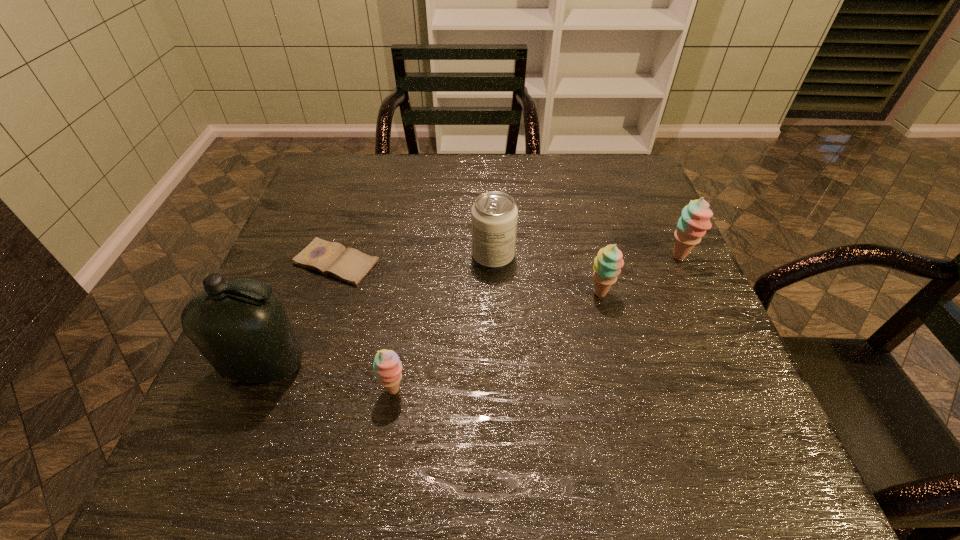
Find the location of a particular element. The image size is (960, 540). unoccupied area between the soda can and the second sherbert from right to left is located at coordinates (547, 275).

I want to click on free space between the bottle and the second nearest sherbert, so click(433, 330).

Locate an element on the screen. The height and width of the screenshot is (540, 960). free spot between the third object from right to left and the second sherbert from left to right is located at coordinates [547, 275].

Find the location of a particular element. The height and width of the screenshot is (540, 960). empty location between the shortest sherbert and the diary is located at coordinates (366, 327).

Locate an element on the screen. The image size is (960, 540). vacant space that's between the tallest object and the rightmost object is located at coordinates (472, 312).

The width and height of the screenshot is (960, 540). What are the coordinates of `empty space that is in between the soda can and the bottle` in the screenshot? It's located at click(x=379, y=311).

In order to click on free space between the shortest sherbert and the shortest object in this screenshot , I will do `click(366, 327)`.

Where is `the fourth closest object relative to the rightmost sherbert`? the fourth closest object relative to the rightmost sherbert is located at coordinates (350, 265).

This screenshot has height=540, width=960. In order to click on object that can be found as the third closest to the tallest object in this screenshot , I will do `click(494, 215)`.

I want to click on the closest sherbert to the second sherbert from right to left, so click(x=695, y=218).